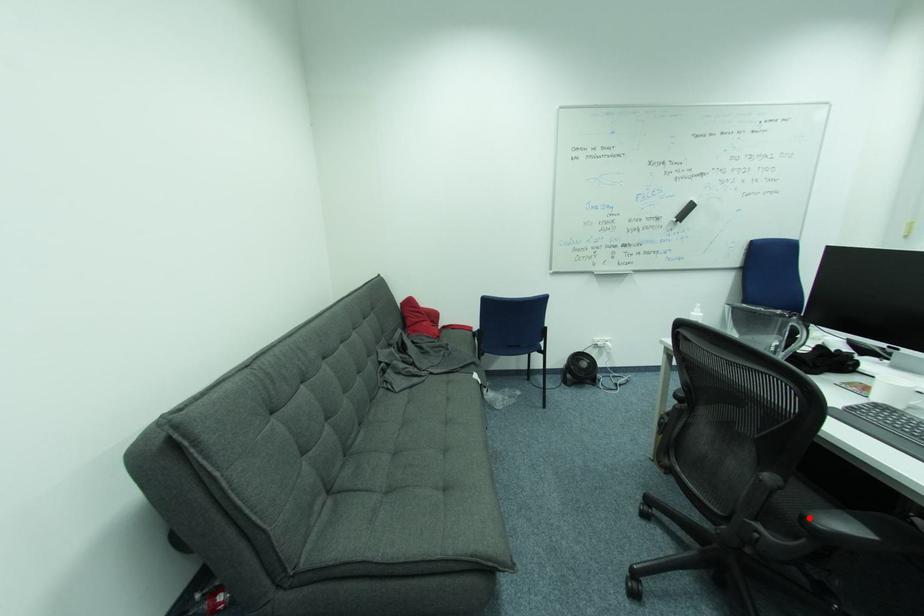
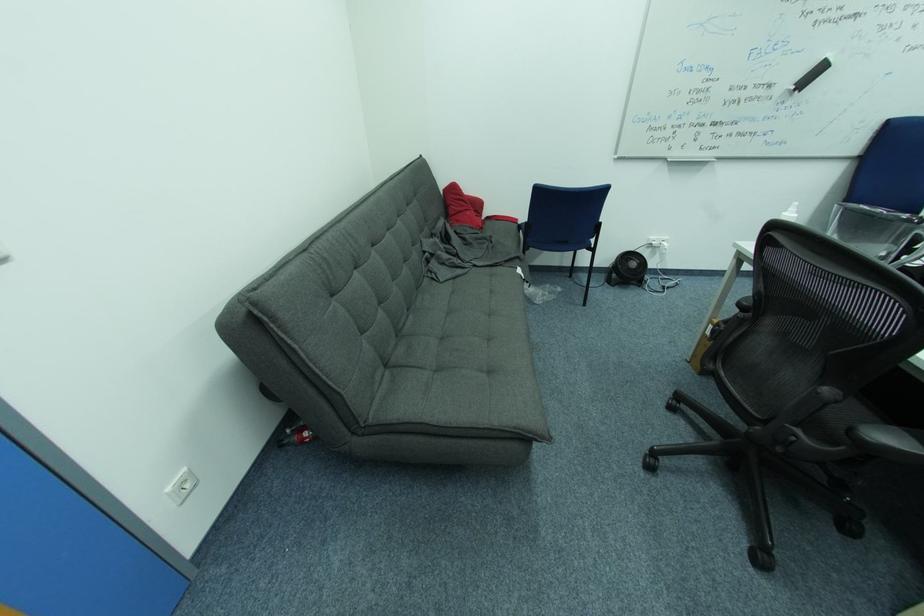
Question: I am providing you with two images of the same scene from different viewpoints. In image1, a red point is highlighted. Considering the same 3D point in image2, which of the following is correct?

Choices:
 (A) It is closer
 (B) It is farther

Answer: (A)